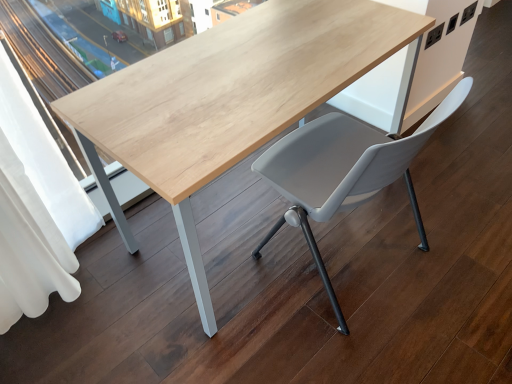
Image resolution: width=512 pixels, height=384 pixels. Find the location of `free point in front of white fabric curtain at left`. free point in front of white fabric curtain at left is located at coordinates (79, 343).